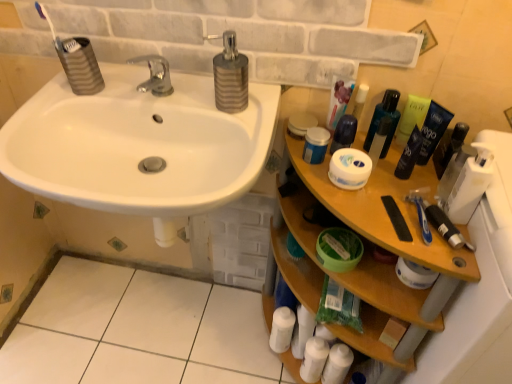
Where is `free space in front of dark blue plastic mouthwash at upper right, which is counted as the fourth mouthwash, starting from the right`? free space in front of dark blue plastic mouthwash at upper right, which is counted as the fourth mouthwash, starting from the right is located at coordinates (408, 217).